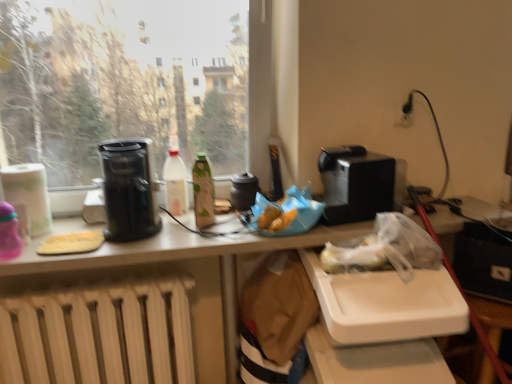
Question: From the image's perspective, is transparent glass window at upper left on black plastic coffee maker at left?

Choices:
 (A) yes
 (B) no

Answer: (A)

Question: Can you confirm if transparent glass window at upper left is wider than black plastic coffee maker at left?

Choices:
 (A) no
 (B) yes

Answer: (A)

Question: Is the surface of transparent glass window at upper left in direct contact with black plastic coffee maker at left?

Choices:
 (A) no
 (B) yes

Answer: (A)

Question: Considering the relative positions of transparent glass window at upper left and black plastic coffee maker at left in the image provided, is transparent glass window at upper left behind black plastic coffee maker at left?

Choices:
 (A) no
 (B) yes

Answer: (A)

Question: Can you confirm if transparent glass window at upper left is shorter than black plastic coffee maker at left?

Choices:
 (A) yes
 (B) no

Answer: (B)

Question: Is the position of transparent glass window at upper left less distant than that of black plastic coffee maker at left?

Choices:
 (A) no
 (B) yes

Answer: (B)

Question: Is green matte bottle at center, which appears as the second bottle when viewed from the left, located within black plastic toaster at upper right, which appears as the second appliance when viewed from the left?

Choices:
 (A) no
 (B) yes

Answer: (A)

Question: Considering the relative sizes of black plastic toaster at upper right, the 1th appliance from the right, and green matte bottle at center, marked as the 1th bottle in a right-to-left arrangement, in the image provided, is black plastic toaster at upper right, the 1th appliance from the right, taller than green matte bottle at center, marked as the 1th bottle in a right-to-left arrangement,?

Choices:
 (A) yes
 (B) no

Answer: (B)

Question: From a real-world perspective, is black plastic toaster at upper right, which appears as the second appliance when viewed from the left, under green matte bottle at center, which appears as the second bottle when viewed from the left?

Choices:
 (A) no
 (B) yes

Answer: (A)

Question: Is black plastic toaster at upper right, the 1th appliance from the right, far away from green matte bottle at center, marked as the 1th bottle in a right-to-left arrangement?

Choices:
 (A) yes
 (B) no

Answer: (B)

Question: Is black plastic toaster at upper right, which appears as the second appliance when viewed from the left, in contact with green matte bottle at center, which appears as the second bottle when viewed from the left?

Choices:
 (A) yes
 (B) no

Answer: (B)

Question: From a real-world perspective, is black plastic toaster at upper right, which appears as the second appliance when viewed from the left, physically above green matte bottle at center, marked as the 1th bottle in a right-to-left arrangement?

Choices:
 (A) yes
 (B) no

Answer: (A)